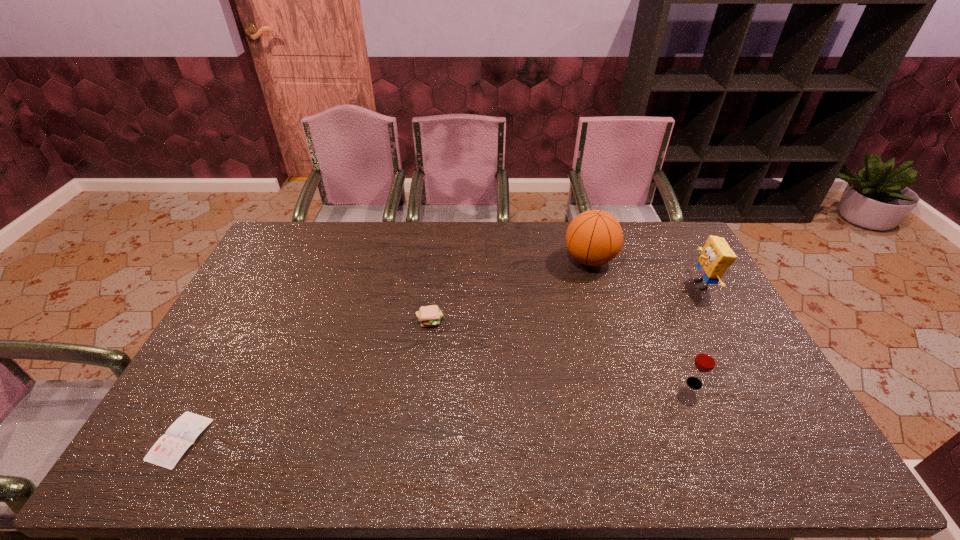
Identify the location of blank space located on the face of the second tallest object. This screenshot has width=960, height=540. (599, 285).

Where is `free space located on the face of the second tallest object`? The width and height of the screenshot is (960, 540). free space located on the face of the second tallest object is located at coordinates (672, 285).

Locate an element on the screen. This screenshot has height=540, width=960. vacant space located on the face of the second tallest object is located at coordinates (582, 285).

Find the location of a particular element. The width and height of the screenshot is (960, 540). vacant space located 0.160m on the front of the fourth object from left to right is located at coordinates (722, 447).

You are a GUI agent. You are given a task and a screenshot of the screen. Output one action in this format:
    pyautogui.click(x=<x>, y=<y>)
    Task: Click on the vacant area located 0.060m on the front of the second shortest object
    Image resolution: width=960 pixels, height=540 pixels.
    Given the screenshot: What is the action you would take?
    pyautogui.click(x=427, y=345)

The width and height of the screenshot is (960, 540). Find the location of `vacant space located on the back of the shortest object`. vacant space located on the back of the shortest object is located at coordinates (227, 354).

You are a GUI agent. You are given a task and a screenshot of the screen. Output one action in this format:
    pyautogui.click(x=<x>, y=<y>)
    Task: Click on the object positioned at the far edge
    The height and width of the screenshot is (540, 960).
    Given the screenshot: What is the action you would take?
    pyautogui.click(x=593, y=238)

At what (x,y) coordinates should I click in order to perform the action: click on object located at the near edge. Please return your answer as a coordinate pair (x, y). The width and height of the screenshot is (960, 540). Looking at the image, I should click on (166, 452).

Identify the location of object located in the left edge section of the desktop. The width and height of the screenshot is (960, 540). (166, 452).

Where is `object located in the right edge section of the desktop`? object located in the right edge section of the desktop is located at coordinates (716, 257).